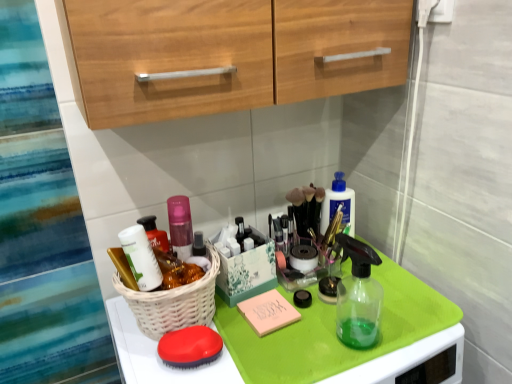
Image resolution: width=512 pixels, height=384 pixels. What are the coordinates of `vacant region above white wicker basket at center (from a real-world perspective)` in the screenshot? It's located at (172, 263).